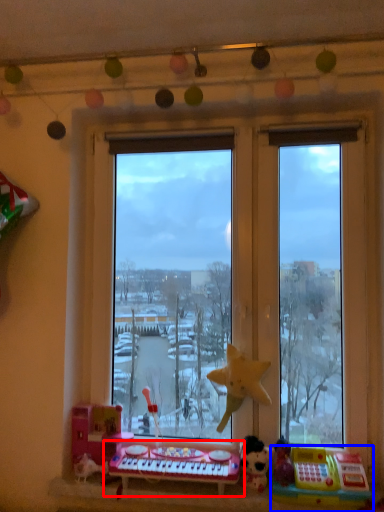
Question: Which object appears closest to the camera in this image, musical keyboard (highlighted by a red box) or toy (highlighted by a blue box)?

Choices:
 (A) musical keyboard
 (B) toy

Answer: (B)